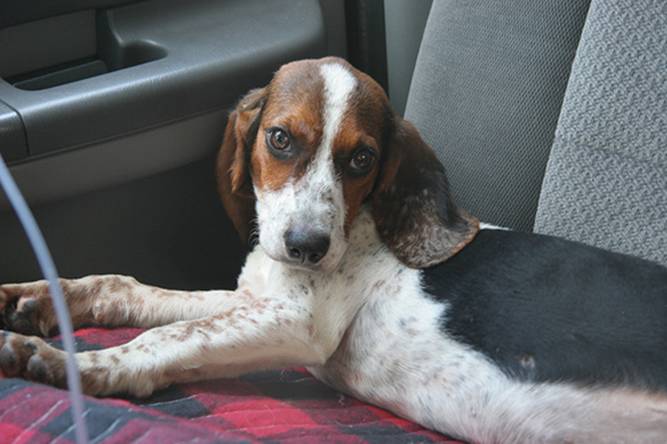
Find the location of a particular element. The image size is (667, 444). bottom of arm rest is located at coordinates (103, 154).